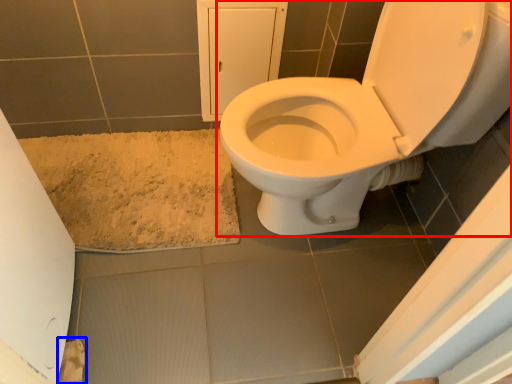
Question: Which object appears farthest to the camera in this image, toilet (highlighted by a red box) or toilet paper (highlighted by a blue box)?

Choices:
 (A) toilet
 (B) toilet paper

Answer: (B)